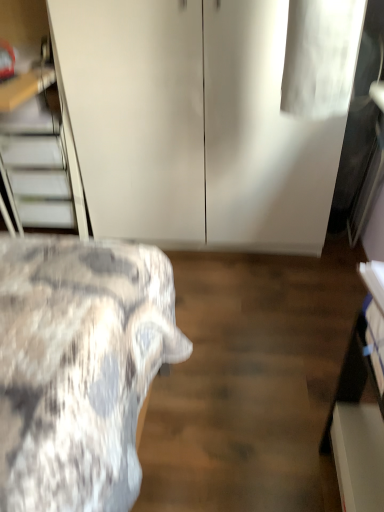
Question: Can you confirm if white matte cabinet at center is positioned to the left of metallic silver stairs at left?

Choices:
 (A) yes
 (B) no

Answer: (B)

Question: Is white matte cabinet at center taller than metallic silver stairs at left?

Choices:
 (A) yes
 (B) no

Answer: (A)

Question: Is metallic silver stairs at left at the back of white matte cabinet at center?

Choices:
 (A) no
 (B) yes

Answer: (A)

Question: From a real-world perspective, is white matte cabinet at center on metallic silver stairs at left?

Choices:
 (A) yes
 (B) no

Answer: (A)

Question: Can you confirm if white matte cabinet at center is positioned to the right of metallic silver stairs at left?

Choices:
 (A) no
 (B) yes

Answer: (B)

Question: Does white matte cabinet at center have a greater width compared to metallic silver stairs at left?

Choices:
 (A) no
 (B) yes

Answer: (B)

Question: Are metallic silver stairs at left and white matte cabinet at center located far from each other?

Choices:
 (A) yes
 (B) no

Answer: (B)

Question: Is metallic silver stairs at left not inside white matte cabinet at center?

Choices:
 (A) yes
 (B) no

Answer: (A)

Question: From the image's perspective, is metallic silver stairs at left over white matte cabinet at center?

Choices:
 (A) yes
 (B) no

Answer: (B)

Question: Can you confirm if metallic silver stairs at left is wider than white matte cabinet at center?

Choices:
 (A) yes
 (B) no

Answer: (B)

Question: Does metallic silver stairs at left appear on the left side of white matte cabinet at center?

Choices:
 (A) no
 (B) yes

Answer: (B)

Question: Is metallic silver stairs at left positioned in front of white matte cabinet at center?

Choices:
 (A) yes
 (B) no

Answer: (B)

Question: In terms of width, does metallic silver stairs at left look wider or thinner when compared to white matte cabinet at center?

Choices:
 (A) thin
 (B) wide

Answer: (A)